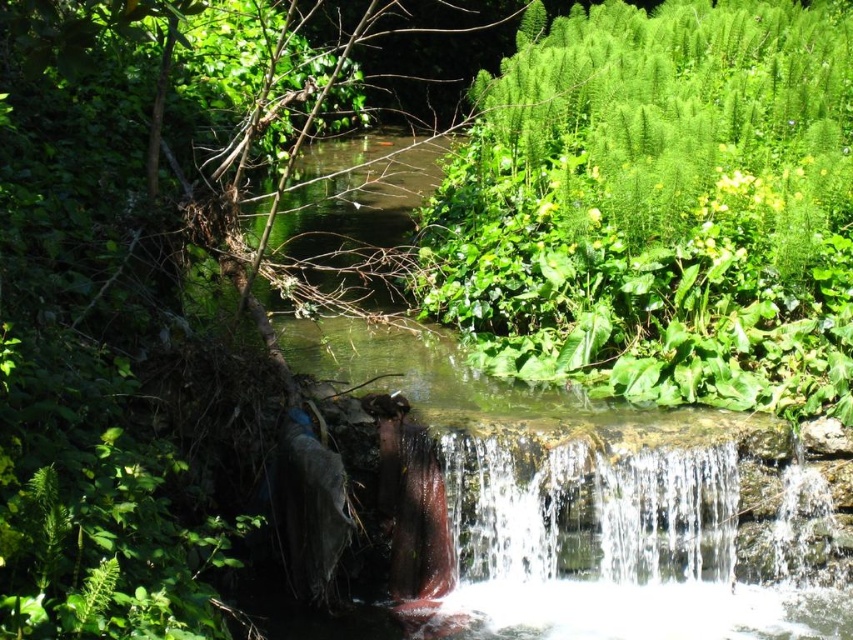
Question: Which object is the farthest from the green mossy rock at center?

Choices:
 (A) green leafy plant at upper right
 (B) clear water at center

Answer: (A)

Question: Does green leafy plant at upper right lie in front of clear water at center?

Choices:
 (A) yes
 (B) no

Answer: (B)

Question: Among these points, which one is farthest from the camera?

Choices:
 (A) (727, 449)
 (B) (488, 460)

Answer: (A)

Question: Which point is farther to the camera?

Choices:
 (A) green leafy plant at upper right
 (B) green mossy rock at center

Answer: (A)

Question: In this image, where is green mossy rock at center located relative to clear water at center?

Choices:
 (A) above
 (B) below

Answer: (A)

Question: Can you confirm if green leafy plant at upper right is wider than green mossy rock at center?

Choices:
 (A) no
 (B) yes

Answer: (A)